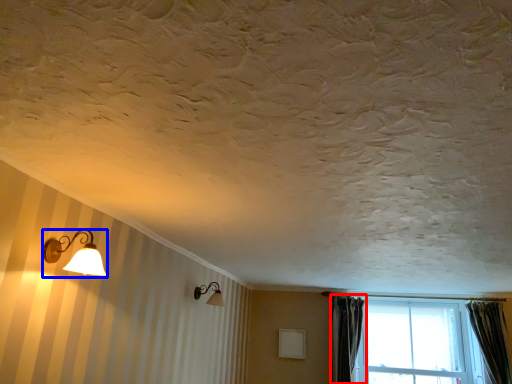
Question: Which point is closer to the camera, curtain (highlighted by a red box) or lamp (highlighted by a blue box)?

Choices:
 (A) curtain
 (B) lamp

Answer: (B)